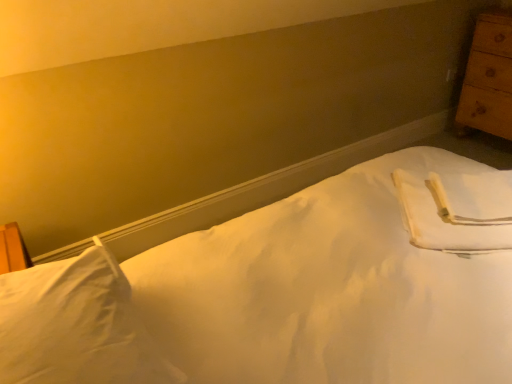
Question: Is white soft pillow at lower left facing towards wooden chest of drawers at right?

Choices:
 (A) yes
 (B) no

Answer: (B)

Question: From a real-world perspective, is white soft pillow at lower left over wooden chest of drawers at right?

Choices:
 (A) yes
 (B) no

Answer: (A)

Question: Does white soft pillow at lower left have a smaller size compared to wooden chest of drawers at right?

Choices:
 (A) no
 (B) yes

Answer: (B)

Question: From the image's perspective, is white soft pillow at lower left on wooden chest of drawers at right?

Choices:
 (A) yes
 (B) no

Answer: (B)

Question: Is there a large distance between white soft pillow at lower left and wooden chest of drawers at right?

Choices:
 (A) yes
 (B) no

Answer: (A)

Question: Considering their positions, is white smooth bed at center located in front of or behind white soft pillow at lower left?

Choices:
 (A) behind
 (B) front

Answer: (B)

Question: Is white smooth bed at center spatially inside white soft pillow at lower left, or outside of it?

Choices:
 (A) outside
 (B) inside

Answer: (A)

Question: In the image, is white smooth bed at center on the left side or the right side of white soft pillow at lower left?

Choices:
 (A) right
 (B) left

Answer: (A)

Question: From their relative heights in the image, would you say white smooth bed at center is taller or shorter than white soft pillow at lower left?

Choices:
 (A) tall
 (B) short

Answer: (A)

Question: Visually, is white soft pillow at lower left positioned to the left or to the right of white smooth bed at center?

Choices:
 (A) left
 (B) right

Answer: (A)

Question: In terms of height, does white soft pillow at lower left look taller or shorter compared to white smooth bed at center?

Choices:
 (A) short
 (B) tall

Answer: (A)

Question: Relative to white smooth bed at center, is white soft pillow at lower left in front or behind?

Choices:
 (A) behind
 (B) front

Answer: (A)

Question: From a real-world perspective, is white soft pillow at lower left positioned above or below white smooth bed at center?

Choices:
 (A) below
 (B) above

Answer: (B)

Question: In the image, is wooden chest of drawers at right on the left side or the right side of white soft pillow at lower left?

Choices:
 (A) right
 (B) left

Answer: (A)

Question: Looking at the image, does wooden chest of drawers at right seem bigger or smaller compared to white soft pillow at lower left?

Choices:
 (A) big
 (B) small

Answer: (A)